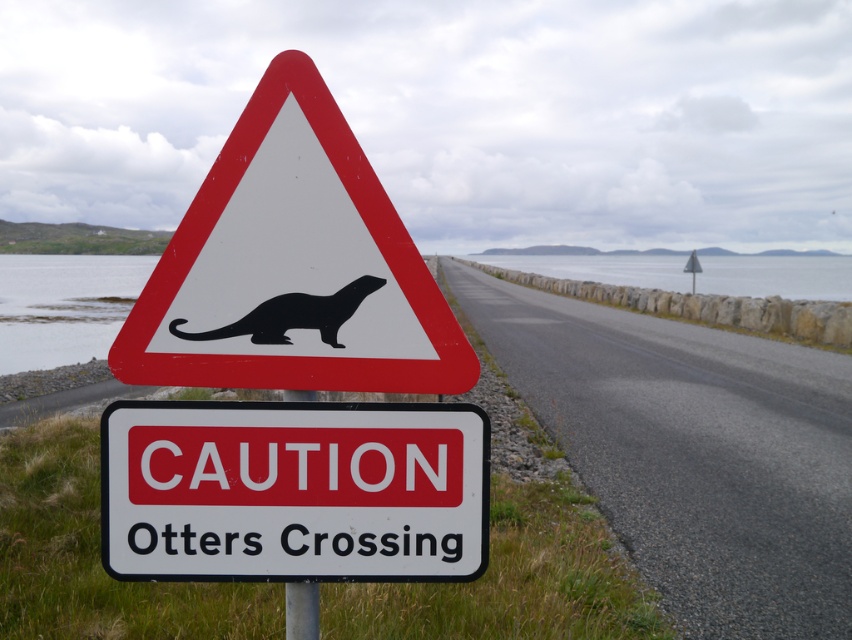
Is transparent water at road center above black matte otter at center?

Yes, transparent water at road center is above black matte otter at center.

Is transparent water at road center below black matte otter at center?

Actually, transparent water at road center is above black matte otter at center.

Is point (807, 291) farther from viewer compared to point (341, 312)?

Yes, point (807, 291) is farther from viewer.

Locate an element on the screen. transparent water at road center is located at coordinates (776, 276).

Is black matte otter at center wider than metallic pole at center?

Indeed, black matte otter at center has a greater width compared to metallic pole at center.

I want to click on black matte otter at center, so click(291, 316).

Looking at this image, is transparent water at road center to the right of metallic pole at center from the viewer's perspective?

Correct, you'll find transparent water at road center to the right of metallic pole at center.

Can you confirm if transparent water at road center is bigger than metallic pole at center?

Indeed, transparent water at road center has a larger size compared to metallic pole at center.

The width and height of the screenshot is (852, 640). I want to click on transparent water at road center, so click(776, 276).